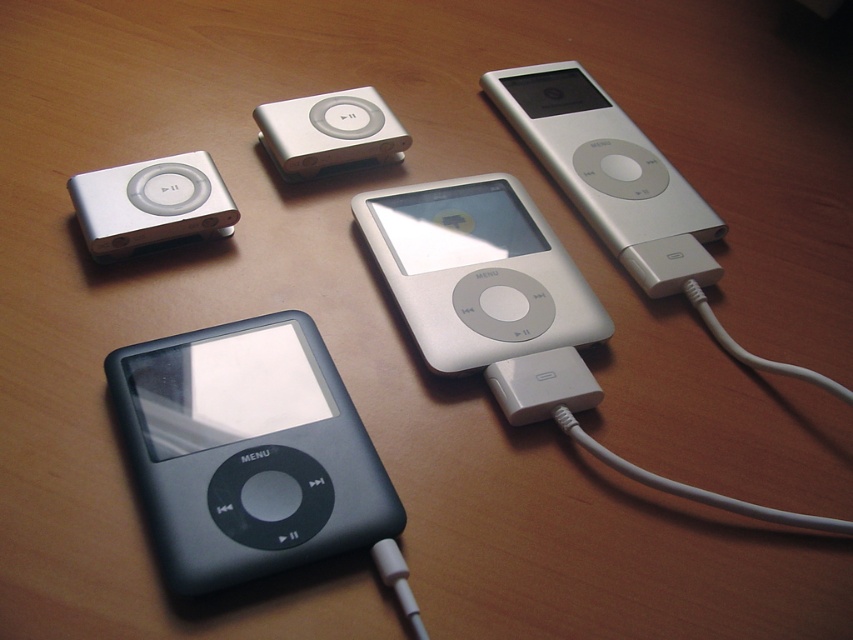
You are holding a measuring tape and need to place the satin silver ipod at center exactly 30 inches away from you. Based on the current arrangement, is it closer or farther than needed?

The satin silver ipod at center is currently 35.24 inches away from the viewer, which is farther than the required 30 inches. To meet the requirement, you need to move it closer by 5.24 inches.

You are standing at the bottom left corner of the wooden surface. Looking towards the top right corner, which point do you see first, point (366, 458) or point (631, 205)?

Point (366, 458) is in front of point (631, 205), so you will see point (366, 458) first.